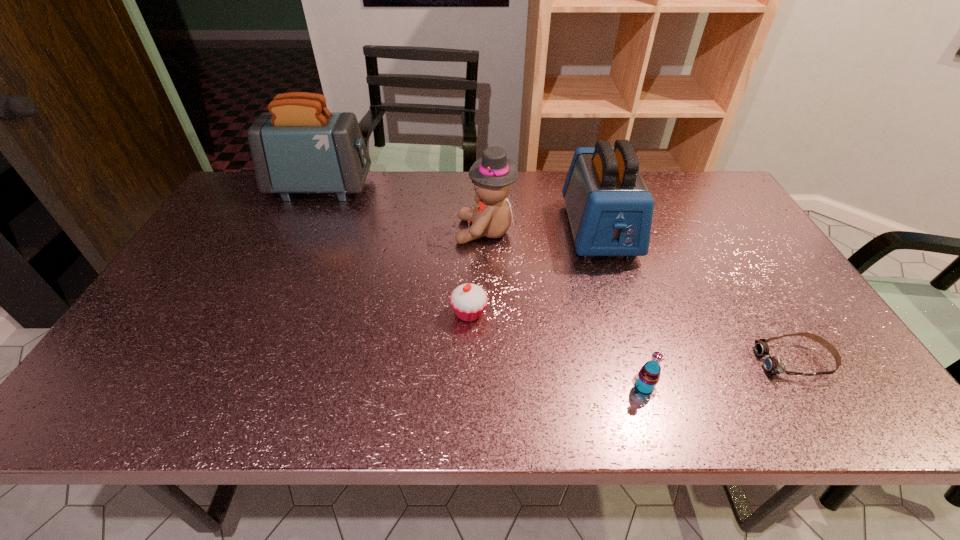
Identify the location of object that is the nearest to the right toaster. (492, 175).

Identify the location of object that is the nearest to the cupcake. (492, 175).

In order to click on vacant region that satisfies the following two spatial constraints: 1. on the front-facing side of the soda; 2. on the right side of the leftmost object in this screenshot , I will do `click(228, 387)`.

The width and height of the screenshot is (960, 540). I want to click on blank area in the image that satisfies the following two spatial constraints: 1. on the front-facing side of the left toaster; 2. on the right side of the soda, so click(228, 387).

At what (x,y) coordinates should I click in order to perform the action: click on vacant area in the image that satisfies the following two spatial constraints: 1. on the front-facing side of the shorter toaster; 2. on the front-facing side of the rag_doll. Please return your answer as a coordinate pair (x, y). Image resolution: width=960 pixels, height=540 pixels. Looking at the image, I should click on (600, 231).

Locate an element on the screen. This screenshot has height=540, width=960. vacant space that satisfies the following two spatial constraints: 1. on the front-facing side of the shorter toaster; 2. on the front-facing side of the rag_doll is located at coordinates (600, 231).

What are the coordinates of `free spot that satisfies the following two spatial constraints: 1. on the front-facing side of the soda; 2. on the right side of the left toaster` in the screenshot? It's located at (228, 387).